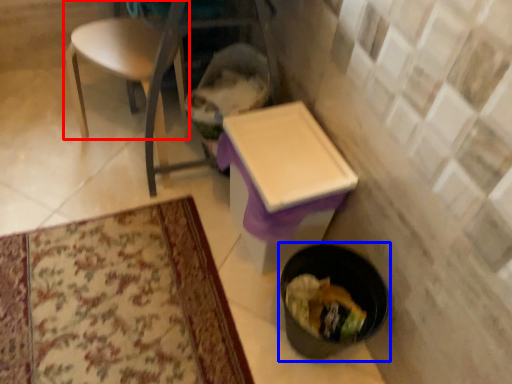
Question: Which object appears closest to the camera in this image, chair (highlighted by a red box) or potty (highlighted by a blue box)?

Choices:
 (A) chair
 (B) potty

Answer: (B)